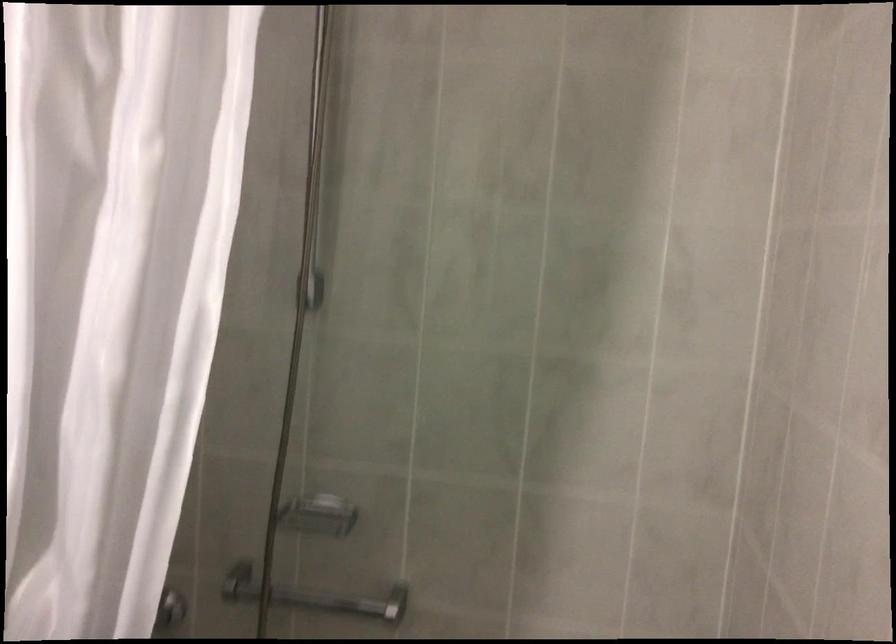
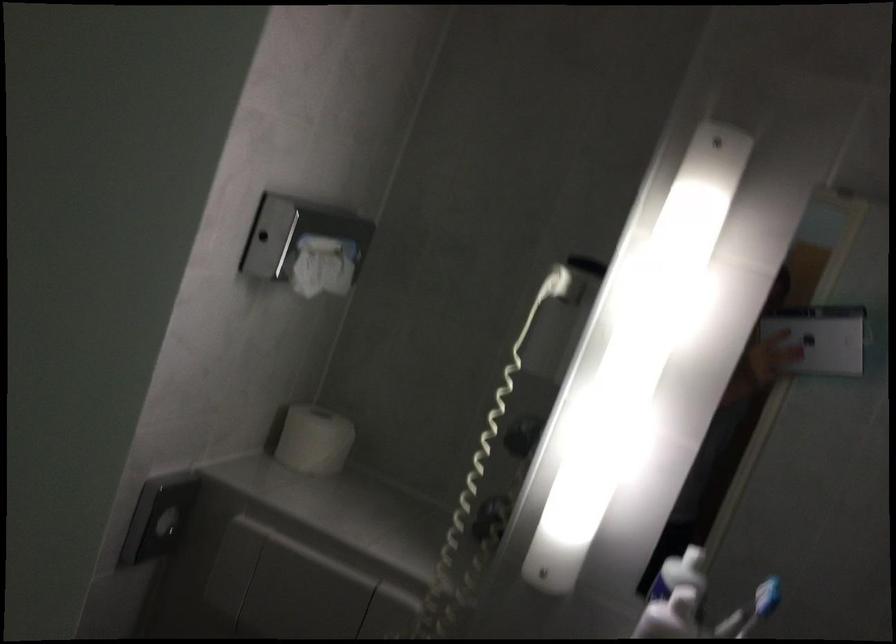
Question: The camera is either moving clockwise (left) or counter-clockwise (right) around the object. The first image is from the beginning of the video and the second image is from the end. Is the camera moving left or right when shooting the video?

Choices:
 (A) Left
 (B) Right

Answer: (B)